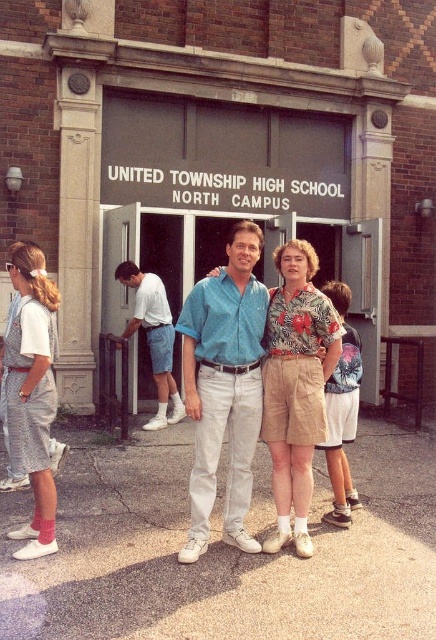
Question: Based on their relative distances, which object is farther from the light blue shirt at center?

Choices:
 (A) floral fabric blouse at center
 (B) floral print shirt at center
 (C) matte blue shirt at center

Answer: (B)

Question: Can you confirm if floral print shirt at center is positioned above plaid denim overall at left?

Choices:
 (A) yes
 (B) no

Answer: (B)

Question: Can you confirm if plaid denim overall at left is positioned to the left of light blue shirt at center?

Choices:
 (A) no
 (B) yes

Answer: (B)

Question: Among these points, which one is nearest to the camera?

Choices:
 (A) (333, 332)
 (B) (269, 378)

Answer: (A)

Question: Does blue cotton shirt at center appear under plaid denim overall at left?

Choices:
 (A) no
 (B) yes

Answer: (B)

Question: Which is farther from the floral print shirt at center?

Choices:
 (A) plaid denim overall at left
 (B) floral fabric blouse at center
 (C) light blue shirt at center
 (D) blue cotton shirt at center

Answer: (C)